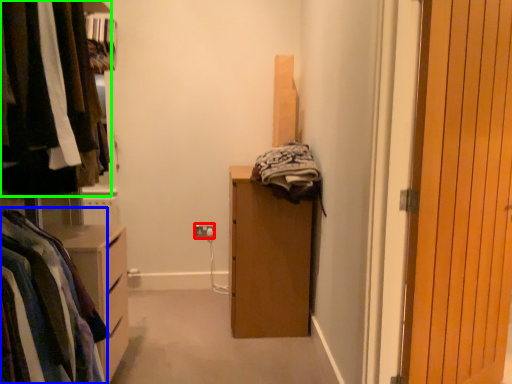
Question: Which object is positioned closest to electric outlet (highlighted by a red box)? Select from clothing (highlighted by a blue box) and closet (highlighted by a green box).

Choices:
 (A) clothing
 (B) closet

Answer: (B)